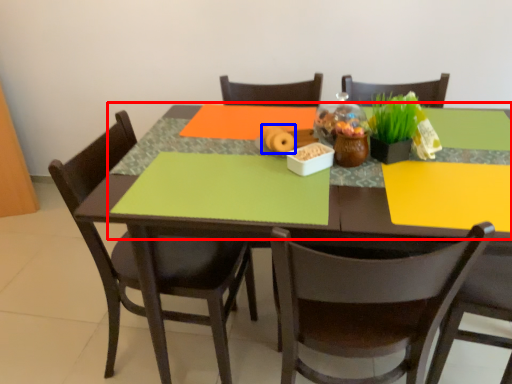
Question: Among these objects, which one is farthest to the camera, tablecloth (highlighted by a red box) or food (highlighted by a blue box)?

Choices:
 (A) tablecloth
 (B) food

Answer: (B)